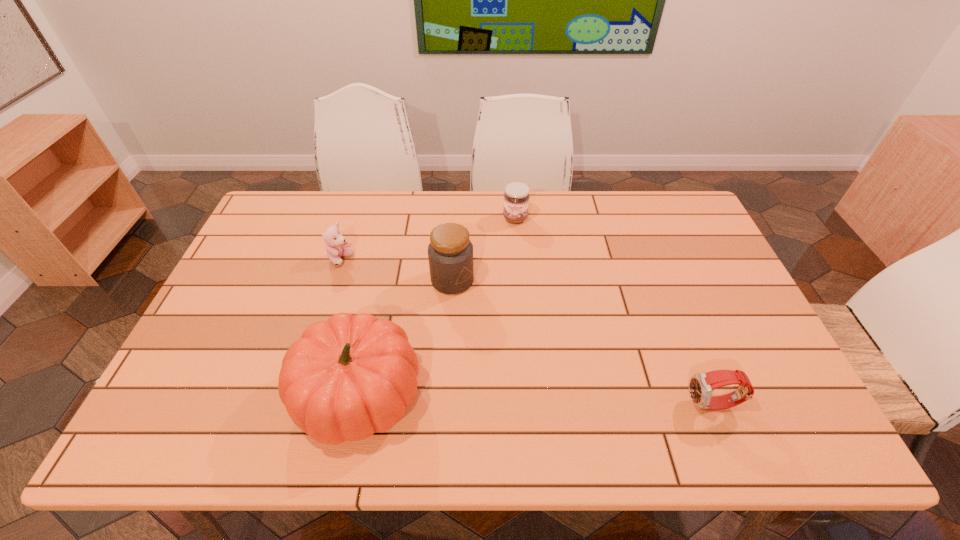
Where is `blank space located 0.090m on the front label of the farthest object`? blank space located 0.090m on the front label of the farthest object is located at coordinates (512, 244).

Image resolution: width=960 pixels, height=540 pixels. What are the coordinates of `vacant space located on the front label of the farthest object` in the screenshot? It's located at (511, 254).

Locate an element on the screen. Image resolution: width=960 pixels, height=540 pixels. vacant space located on the front label of the farthest object is located at coordinates (505, 303).

What are the coordinates of `blank space located 0.110m at the face of the teddy bear` in the screenshot? It's located at (367, 286).

Find the location of a particular element. free space located 0.070m at the face of the teddy bear is located at coordinates (359, 279).

What are the coordinates of `vacant area situated at the face of the teddy bear` in the screenshot? It's located at (391, 309).

The height and width of the screenshot is (540, 960). Find the location of `free region located 0.110m on the surface of the jar near the warning symbol`. free region located 0.110m on the surface of the jar near the warning symbol is located at coordinates (486, 318).

Where is `vacant space located on the surface of the jar near the warning symbol`? The height and width of the screenshot is (540, 960). vacant space located on the surface of the jar near the warning symbol is located at coordinates (540, 380).

This screenshot has height=540, width=960. Find the location of `free space located on the surface of the jar near the warning symbol`. free space located on the surface of the jar near the warning symbol is located at coordinates (507, 343).

Where is `object positioned at the far edge`? object positioned at the far edge is located at coordinates 516,196.